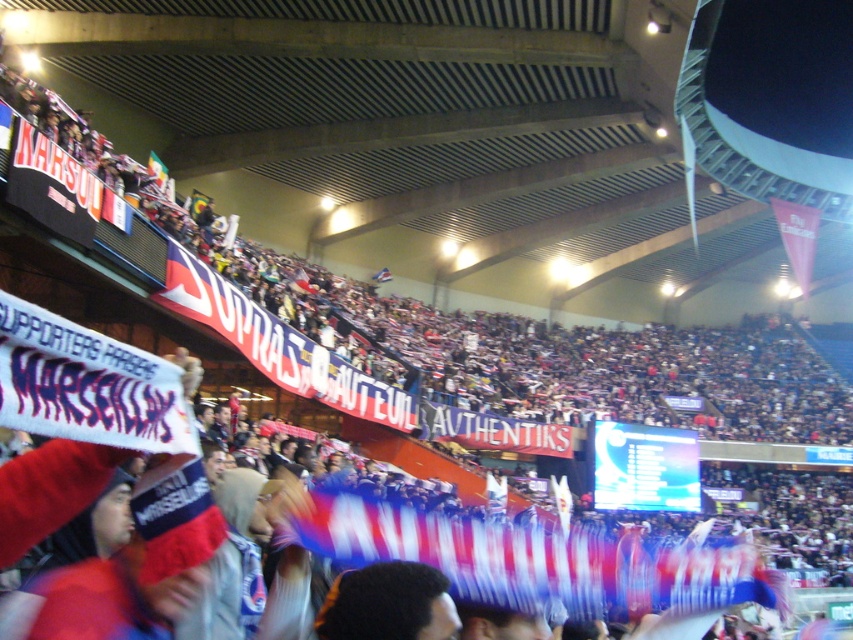
Is point (596, 616) farther from camera compared to point (374, 280)?

No, (596, 616) is in front of (374, 280).

Looking at this image, can you confirm if blue and white fabric banner at center is positioned above blue fabric flag at center?

Actually, blue and white fabric banner at center is below blue fabric flag at center.

You are a GUI agent. You are given a task and a screenshot of the screen. Output one action in this format:
    pyautogui.click(x=<x>, y=<y>)
    Task: Click on the blue and white fabric banner at center
    The image size is (853, 640).
    Given the screenshot: What is the action you would take?
    pyautogui.click(x=531, y=560)